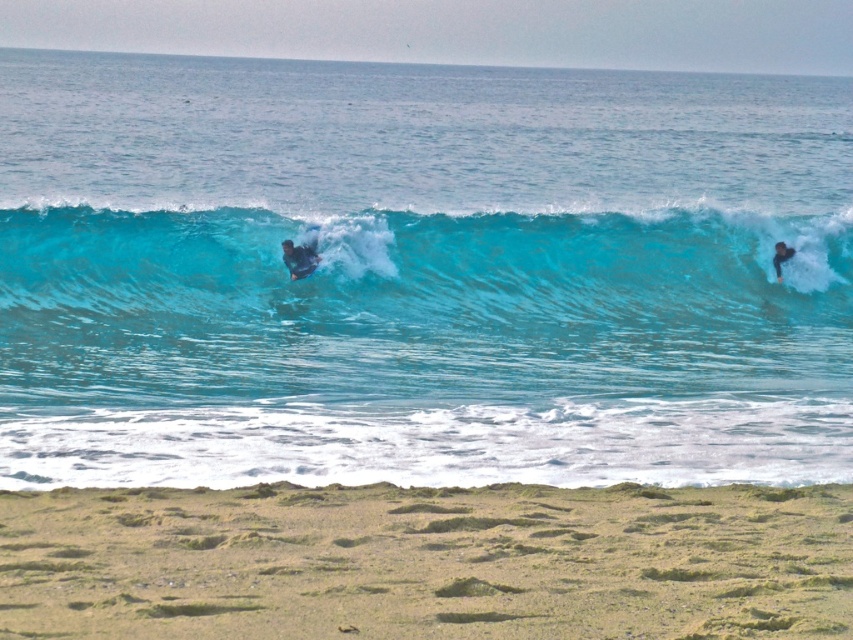
Image resolution: width=853 pixels, height=640 pixels. What do you see at coordinates (421, 275) in the screenshot?
I see `translucent blue water at center` at bounding box center [421, 275].

Is translucent blue water at center below smooth black wetsuit at center?

No, translucent blue water at center is not below smooth black wetsuit at center.

You are a GUI agent. You are given a task and a screenshot of the screen. Output one action in this format:
    pyautogui.click(x=<x>, y=<y>)
    Task: Click on the translucent blue water at center
    This screenshot has width=853, height=640.
    Given the screenshot: What is the action you would take?
    pyautogui.click(x=421, y=275)

Is blue glossy water at center shorter than grainy sand at lower center?

No, blue glossy water at center is not shorter than grainy sand at lower center.

Can you confirm if blue glossy water at center is positioned below grainy sand at lower center?

Incorrect, blue glossy water at center is not positioned below grainy sand at lower center.

This screenshot has width=853, height=640. Describe the element at coordinates (419, 273) in the screenshot. I see `blue glossy water at center` at that location.

You are a GUI agent. You are given a task and a screenshot of the screen. Output one action in this format:
    pyautogui.click(x=<x>, y=<y>)
    Task: Click on the blue glossy water at center
    Image resolution: width=853 pixels, height=640 pixels.
    Given the screenshot: What is the action you would take?
    pyautogui.click(x=419, y=273)

Which of these two, blue glossy water at center or translucent blue water at center, stands taller?

With more height is blue glossy water at center.

Who is positioned more to the left, blue glossy water at center or translucent blue water at center?

From the viewer's perspective, blue glossy water at center appears more on the left side.

Which is behind, point (788, 433) or point (517, 321)?

The point (517, 321) is more distant.

What are the coordinates of `blue glossy water at center` in the screenshot? It's located at (419, 273).